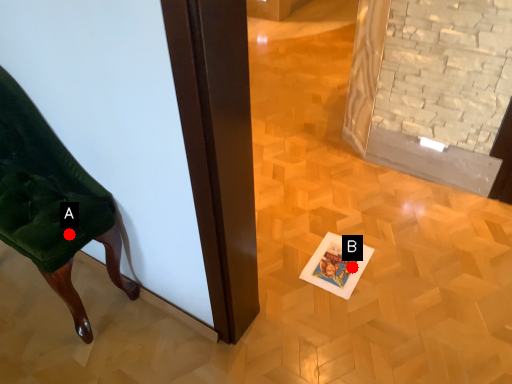
Question: Two points are circled on the image, labeled by A and B beside each circle. Which point is further to the camera?

Choices:
 (A) A is further
 (B) B is further

Answer: (B)